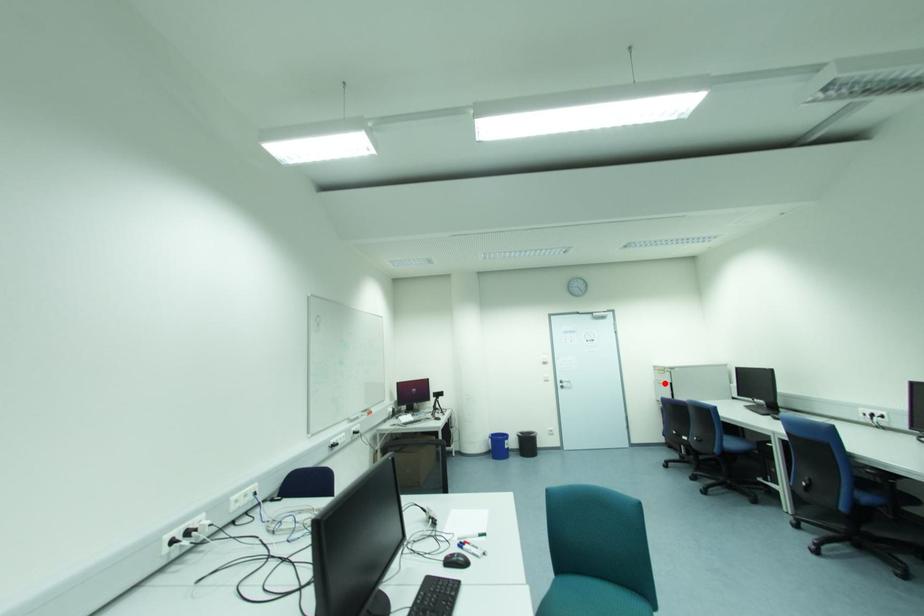
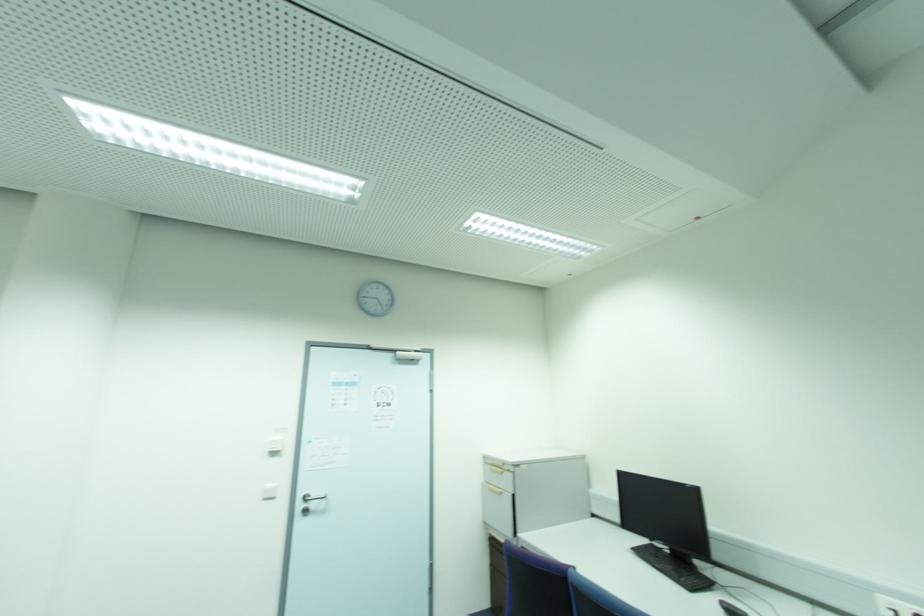
Locate, in the second image, the point that corresponds to the highlighted location in the first image.

(502, 493)